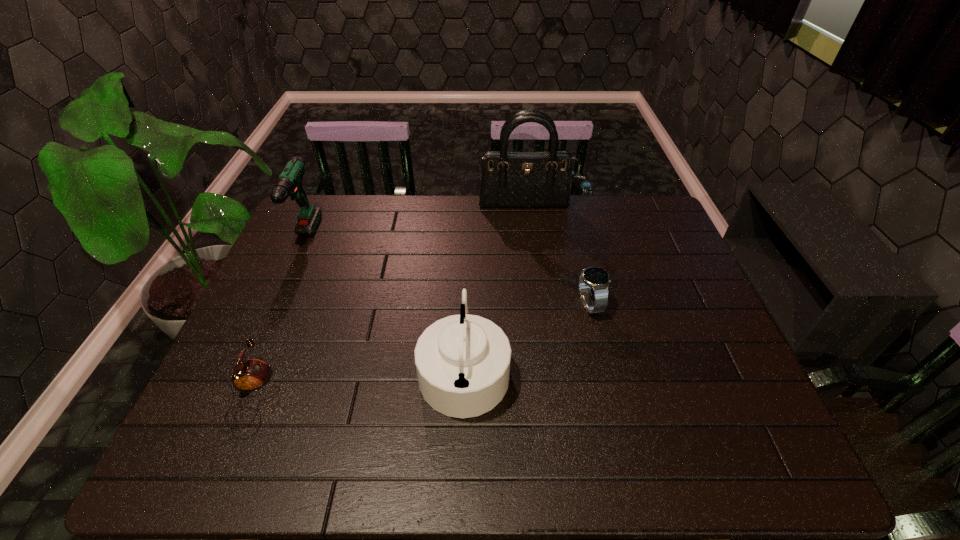
Where is `free space that satisfies the following two spatial constraints: 1. on the handle side of the watch; 2. on the right side of the fourth shortest object`? This screenshot has height=540, width=960. free space that satisfies the following two spatial constraints: 1. on the handle side of the watch; 2. on the right side of the fourth shortest object is located at coordinates (275, 305).

Image resolution: width=960 pixels, height=540 pixels. Identify the location of vacant position in the image that satisfies the following two spatial constraints: 1. on the handle side of the fourth tallest object; 2. on the right side of the drill. (275, 305).

Locate an element on the screen. The width and height of the screenshot is (960, 540). vacant space that satisfies the following two spatial constraints: 1. with an open clasp on the front of the tallest object; 2. on the rotary dial of the telephone is located at coordinates (550, 396).

At what (x,y) coordinates should I click in order to perform the action: click on free space that satisfies the following two spatial constraints: 1. with an open clasp on the front of the farthest object; 2. on the rotary dial of the telephone. Please return your answer as a coordinate pair (x, y). This screenshot has height=540, width=960. Looking at the image, I should click on (550, 396).